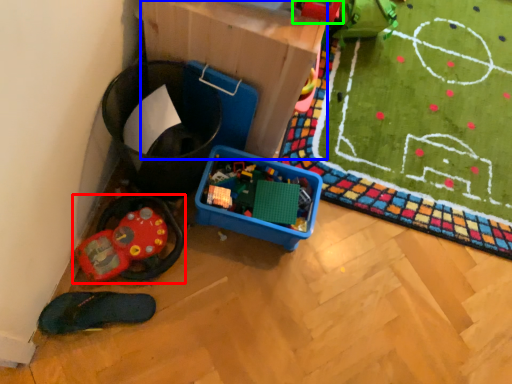
Question: Which object is the farthest from toy (highlighted by a red box)? Choose among these: cardboard box (highlighted by a blue box) or toy (highlighted by a green box).

Choices:
 (A) cardboard box
 (B) toy

Answer: (B)